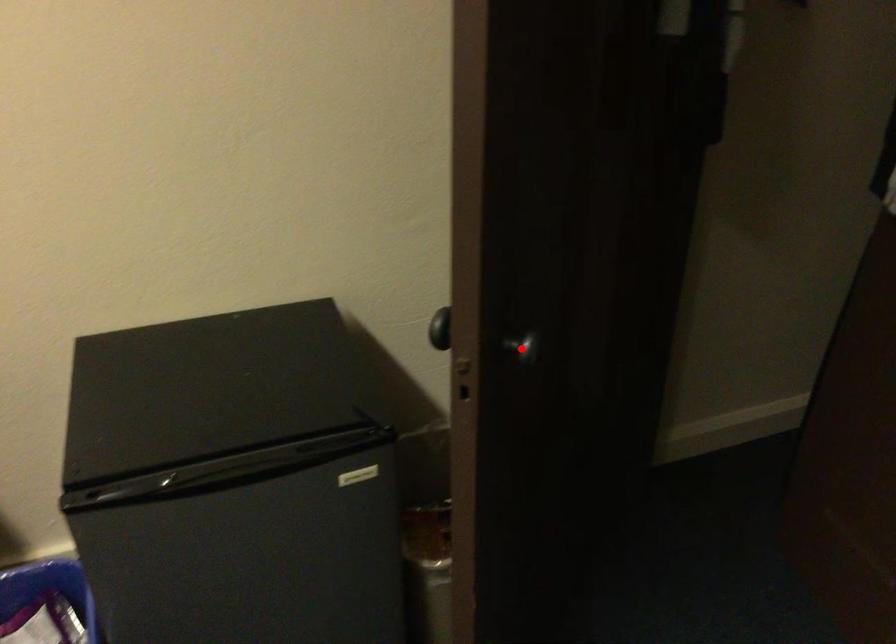
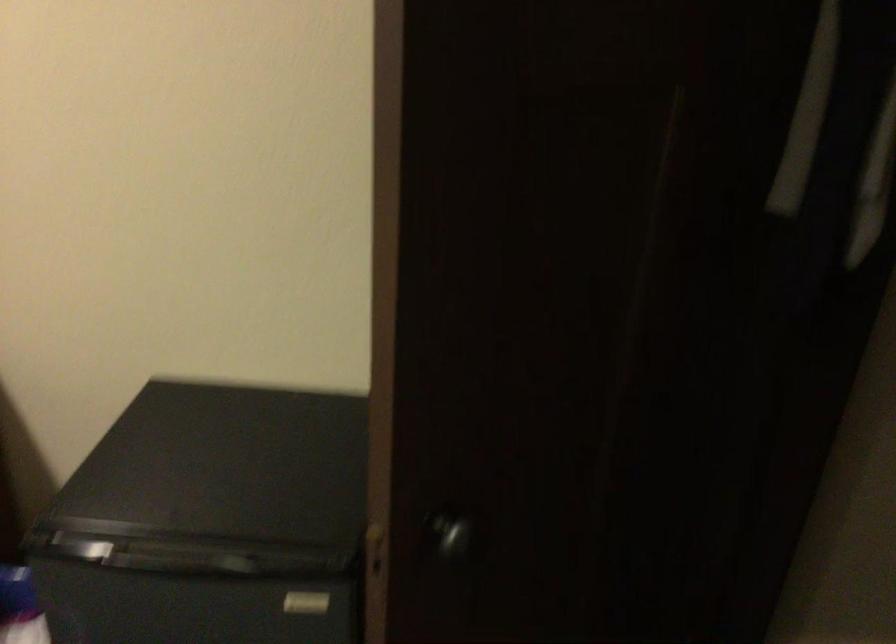
In the second image, find the point that corresponds to the highlighted location in the first image.

(451, 535)